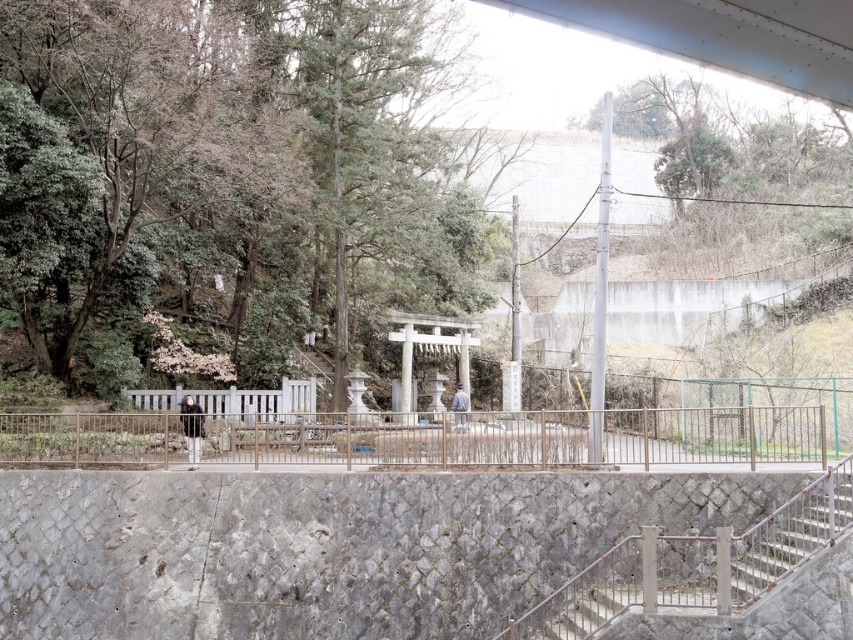
Is gray stone stairs at lower right above metallic gray staircase at lower right?

No.

Who is more forward, (645, 580) or (779, 515)?

Point (645, 580) is in front.

Where is `gray stone stairs at lower right`? Image resolution: width=853 pixels, height=640 pixels. gray stone stairs at lower right is located at coordinates (694, 564).

Can you confirm if green leafy tree at center is positioned to the left of metallic gray staircase at lower right?

Yes, green leafy tree at center is to the left of metallic gray staircase at lower right.

In the scene shown: Measure the distance between point (450, 220) and camera.

They are 52.37 meters apart.

Locate an element on the screen. green leafy tree at center is located at coordinates (227, 170).

Which is above, green leafy tree at center or gray stone stairs at lower right?

green leafy tree at center is above.

Between green leafy tree at center and gray stone stairs at lower right, which one has more height?

green leafy tree at center

Which is in front, point (274, 282) or point (563, 598)?

Point (563, 598)

Locate an element on the screen. Image resolution: width=853 pixels, height=640 pixels. green leafy tree at center is located at coordinates (227, 170).